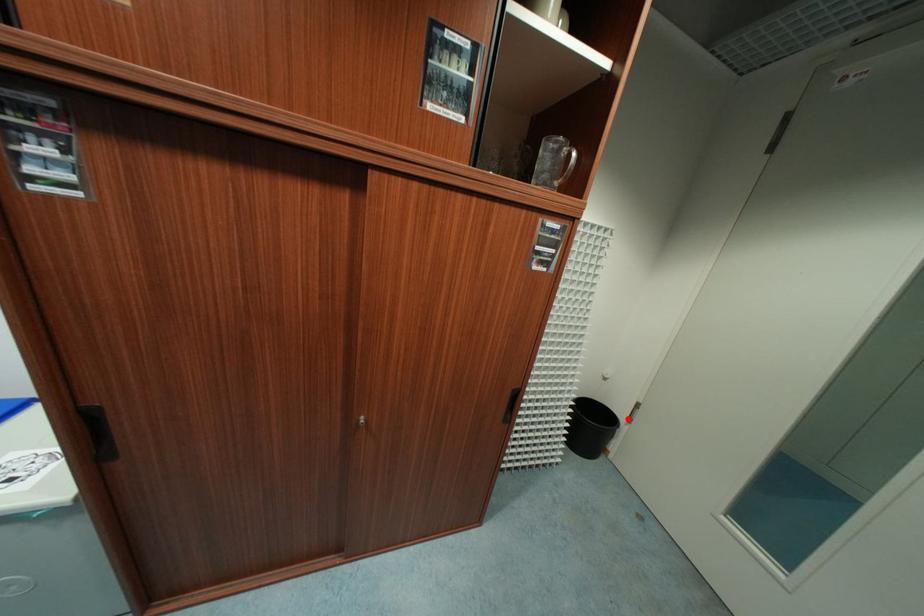
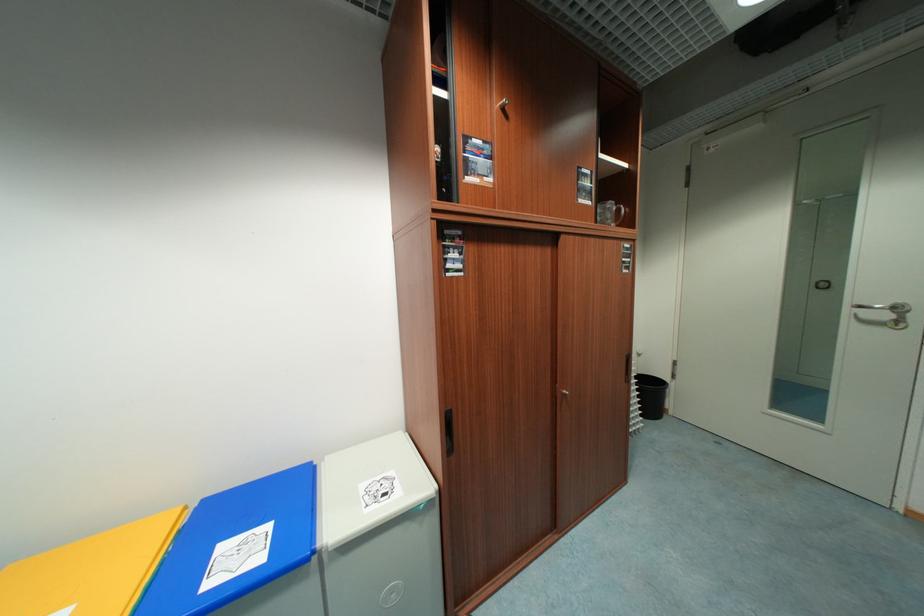
In the second image, find the point that corresponds to the highlighted location in the first image.

(672, 379)